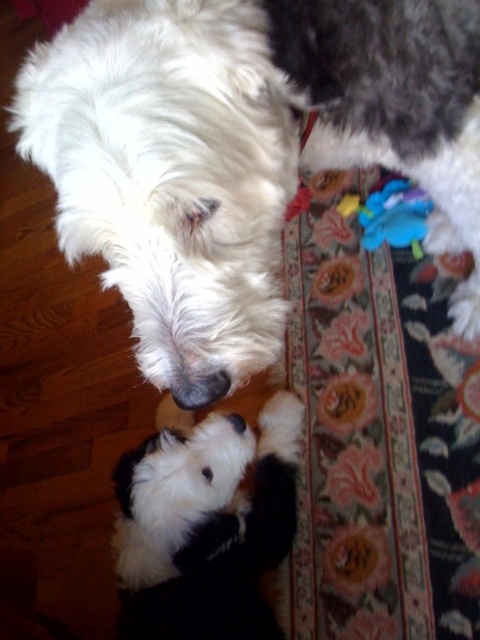
Is point (54, 42) positioned before point (420, 240)?

No, it is behind (420, 240).

Is point (156, 116) less distant than point (432, 208)?

Yes, it is.

At what (x,y) coordinates should I click in order to perform the action: click on white fluffy dog at upper left. Please return your answer as a coordinate pair (x, y). Looking at the image, I should click on (170, 177).

Can you confirm if blue fabric toy at center is smaller than black fur nose at center?

Actually, blue fabric toy at center might be larger than black fur nose at center.

Who is positioned more to the right, blue fabric toy at center or black fur nose at center?

Positioned to the right is blue fabric toy at center.

Identify the location of blue fabric toy at center. (395, 216).

Who is higher up, white fluffy dog at center or black fur nose at center?

Positioned higher is black fur nose at center.

Who is lower down, white fluffy dog at center or black fur nose at center?

white fluffy dog at center is lower down.

Who is more forward, (132, 556) or (229, 413)?

Positioned in front is point (132, 556).

Locate an element on the screen. white fluffy dog at center is located at coordinates (204, 524).